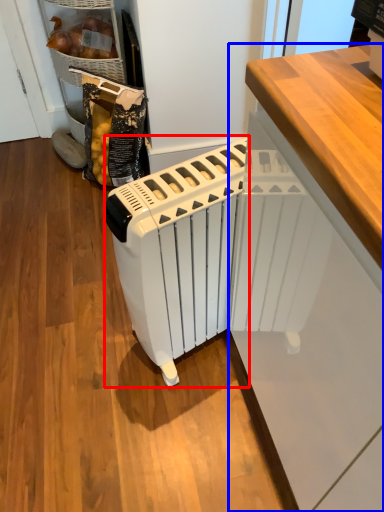
Question: Which object appears farthest to the camera in this image, home appliance (highlighted by a red box) or cabinetry (highlighted by a blue box)?

Choices:
 (A) home appliance
 (B) cabinetry

Answer: (A)